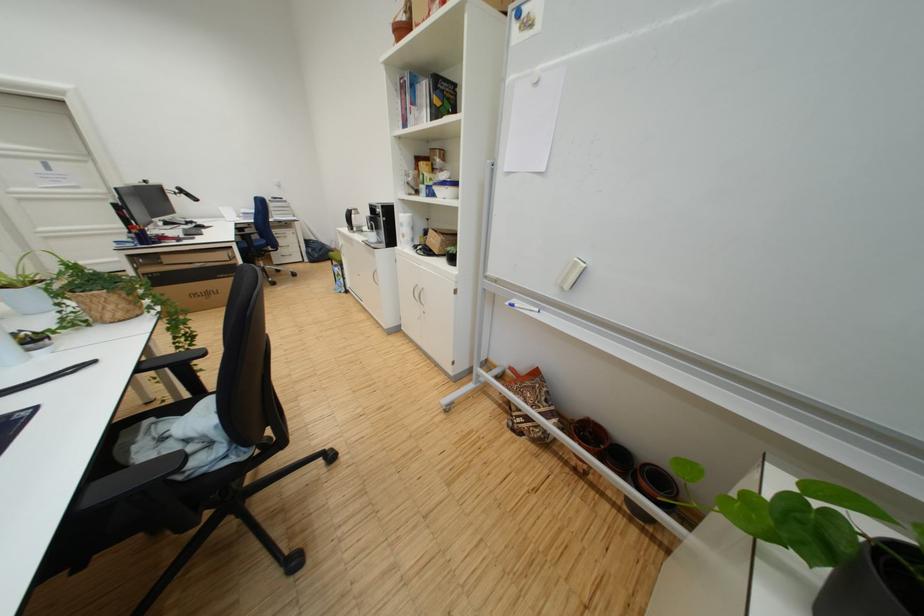
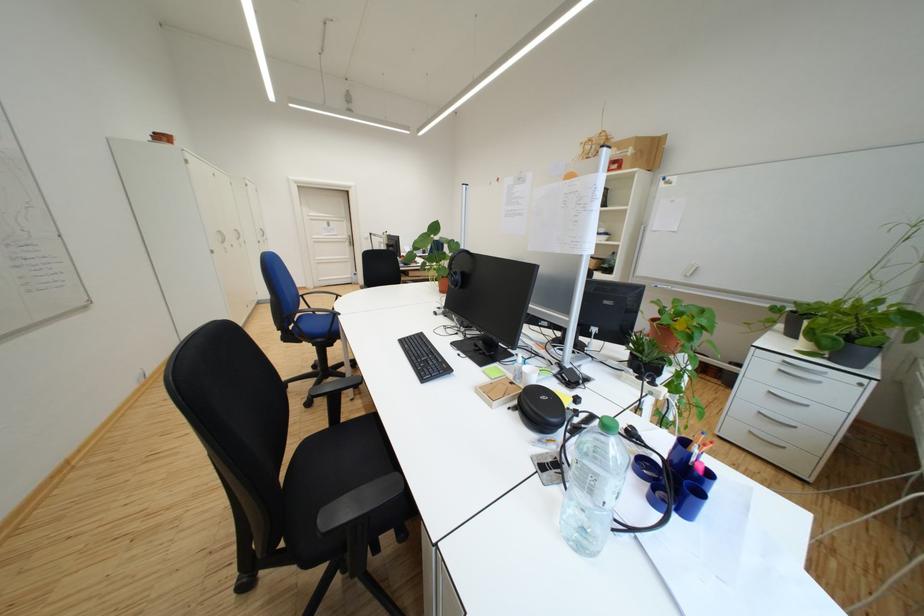
Based on the photo, in a continuous first-person perspective shot, in which direction is the camera moving?

The cameraman walked toward left, backward.